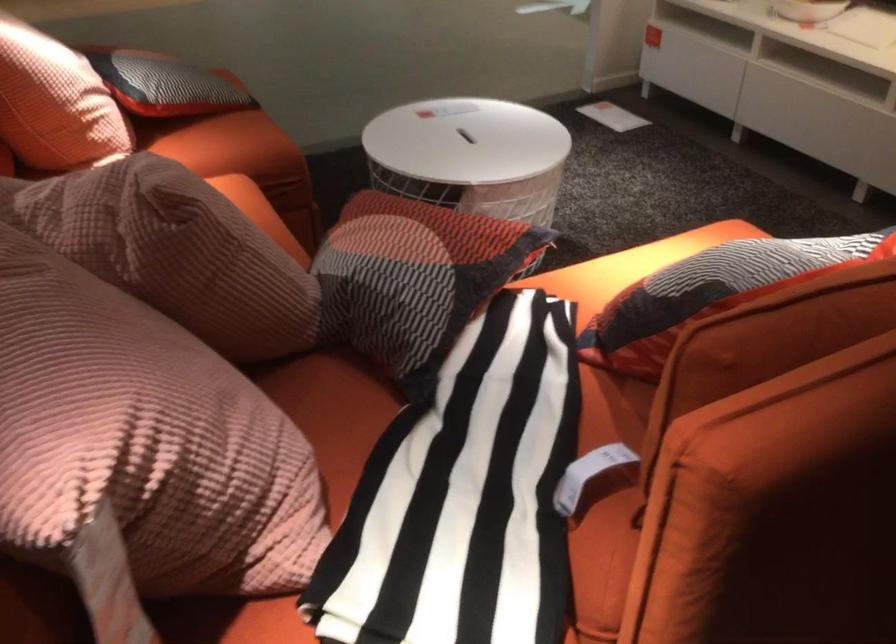
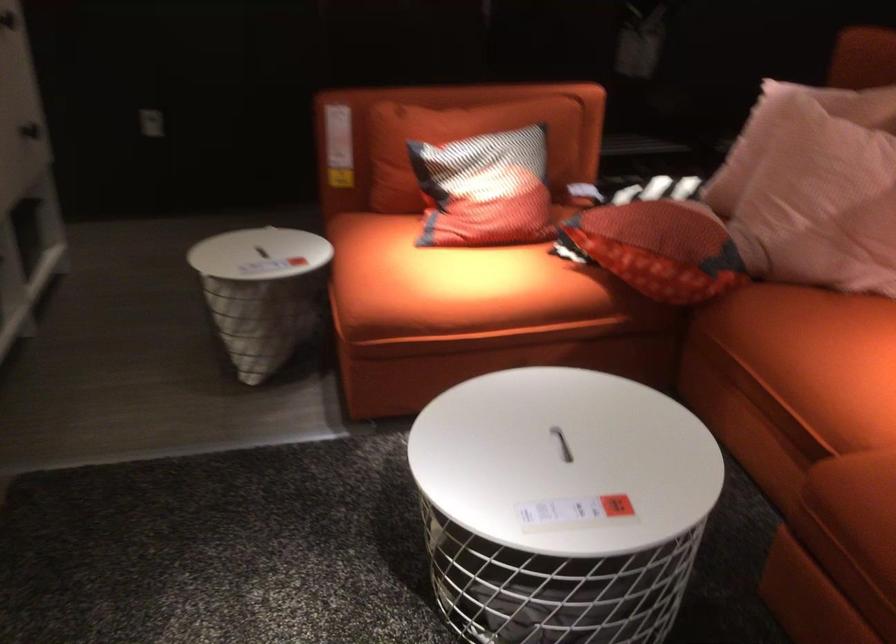
The point at (403, 204) is marked in the first image. Where is the corresponding point in the second image?

(659, 248)